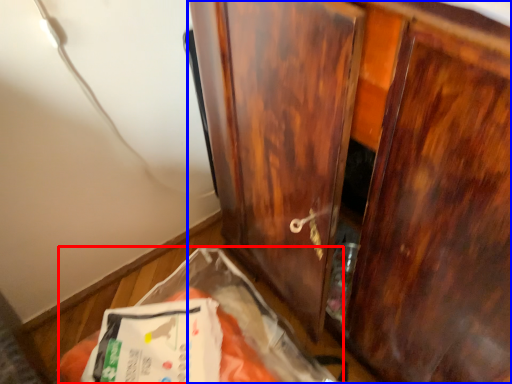
Question: Which object appears closest to the camera in this image, waste (highlighted by a red box) or cupboard (highlighted by a blue box)?

Choices:
 (A) waste
 (B) cupboard

Answer: (B)